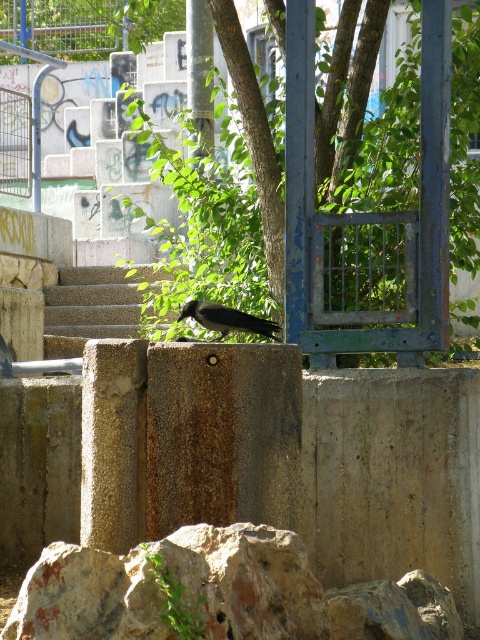
What do you see at coordinates (96, 301) in the screenshot?
I see `brown stone stairs at center` at bounding box center [96, 301].

Which is above, brown stone stairs at center or shiny black crow at center?

Positioned higher is brown stone stairs at center.

Describe the element at coordinates (96, 301) in the screenshot. I see `brown stone stairs at center` at that location.

You are a GUI agent. You are given a task and a screenshot of the screen. Output one action in this format:
    pyautogui.click(x=<x>, y=<y>)
    Task: Click on the brown stone stairs at center
    The width and height of the screenshot is (480, 640).
    Given the screenshot: What is the action you would take?
    tap(96, 301)

Is the position of green leafy tree at center more distant than that of brown stone stairs at center?

No.

Which is behind, point (364, 316) or point (144, 314)?

The point (144, 314) is behind.

Is point (364, 220) positioned after point (91, 324)?

No, (364, 220) is closer to viewer.

Locate an element on the screen. The image size is (480, 640). green leafy tree at center is located at coordinates (368, 220).

Does green leafy tree at center come in front of shiny black crow at center?

No, it is not.

Consider the image. Is green leafy tree at center wider than shiny black crow at center?

Correct, the width of green leafy tree at center exceeds that of shiny black crow at center.

Between point (375, 321) and point (200, 310), which one is positioned in front?

Point (200, 310)

Identify the location of green leafy tree at center. This screenshot has height=640, width=480. (368, 220).